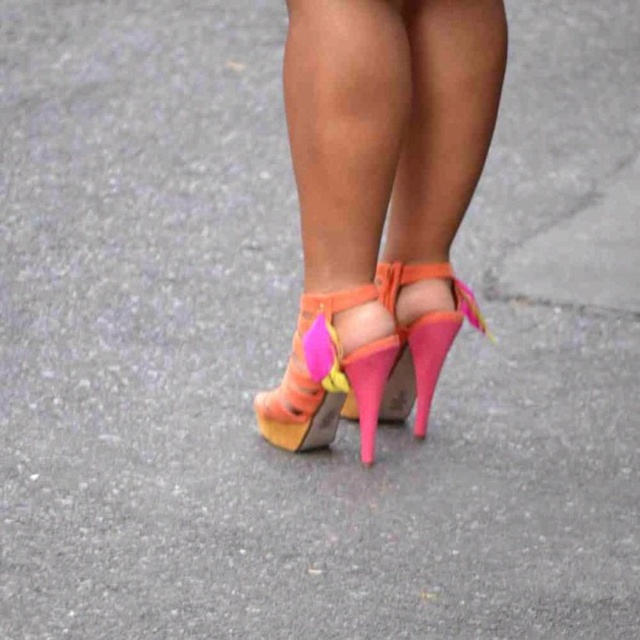
You are a fashion designer observing the image of a person wearing two pairs of shoes. You need to determine which shoe is visible on top. Which one is the neon pink leather high heels at center compared to the pink suede sandal at center?

The neon pink leather high heels at center is positioned over the pink suede sandal at center, so the neon pink leather high heels at center is the one visible on top.